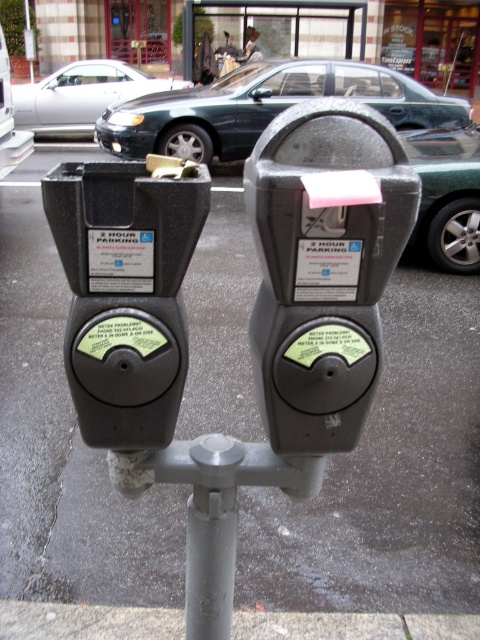
Question: Which of the following is the farthest from the observer?

Choices:
 (A) metallic silver couple at center
 (B) metallic green sedan at center
 (C) green metallic car at right
 (D) gray concrete curb at lower center

Answer: (A)

Question: Can you confirm if gray concrete pavement at center is bigger than matte black parking meter at left?

Choices:
 (A) yes
 (B) no

Answer: (A)

Question: Which point appears farthest from the camera in this image?

Choices:
 (A) (437, 504)
 (B) (471, 230)
 (C) (152, 244)

Answer: (B)

Question: Can you confirm if gray concrete pavement at center is positioned to the left of metallic silver couple at center?

Choices:
 (A) no
 (B) yes

Answer: (A)

Question: Where is green metallic car at right located in relation to metallic silver couple at center in the image?

Choices:
 (A) below
 (B) above

Answer: (A)

Question: Estimate the real-world distances between objects in this image. Which object is farther from the gray concrete pavement at center?

Choices:
 (A) silver metallic sedan at center
 (B) gray concrete curb at lower center
 (C) metallic silver couple at center

Answer: (C)